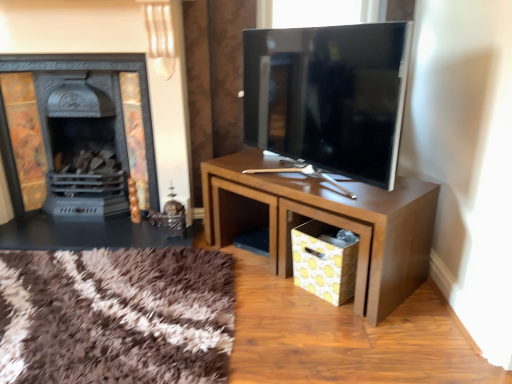
Question: Can you confirm if black matte fireplace at left is shorter than matte black tv at center?

Choices:
 (A) no
 (B) yes

Answer: (A)

Question: Is matte black tv at center a part of black matte fireplace at left?

Choices:
 (A) no
 (B) yes

Answer: (A)

Question: Is black matte fireplace at left turned away from matte black tv at center?

Choices:
 (A) no
 (B) yes

Answer: (A)

Question: Is black matte fireplace at left touching matte black tv at center?

Choices:
 (A) yes
 (B) no

Answer: (B)

Question: Can we say black matte fireplace at left lies outside matte black tv at center?

Choices:
 (A) no
 (B) yes

Answer: (B)

Question: Based on their positions, is black matte fireplace at left located to the left or right of matte black tv at center?

Choices:
 (A) right
 (B) left

Answer: (B)

Question: Would you say black matte fireplace at left is inside or outside matte black tv at center?

Choices:
 (A) outside
 (B) inside

Answer: (A)

Question: From a real-world perspective, is black matte fireplace at left positioned above or below matte black tv at center?

Choices:
 (A) above
 (B) below

Answer: (B)

Question: Considering the positions of black matte fireplace at left and matte black tv at center in the image, is black matte fireplace at left bigger or smaller than matte black tv at center?

Choices:
 (A) big
 (B) small

Answer: (A)

Question: Is matte black tv at center wider or thinner than yellow paper drawer at lower right?

Choices:
 (A) thin
 (B) wide

Answer: (B)

Question: From their relative heights in the image, would you say matte black tv at center is taller or shorter than yellow paper drawer at lower right?

Choices:
 (A) tall
 (B) short

Answer: (A)

Question: Does point (360, 135) appear closer or farther from the camera than point (283, 243)?

Choices:
 (A) farther
 (B) closer

Answer: (B)

Question: From the image's perspective, relative to yellow paper drawer at lower right, is matte black tv at center above or below?

Choices:
 (A) above
 (B) below

Answer: (A)

Question: Considering the positions of brown wood table at center and black matte fireplace at left in the image, is brown wood table at center wider or thinner than black matte fireplace at left?

Choices:
 (A) thin
 (B) wide

Answer: (B)

Question: From the image's perspective, is brown wood table at center positioned above or below black matte fireplace at left?

Choices:
 (A) below
 (B) above

Answer: (A)